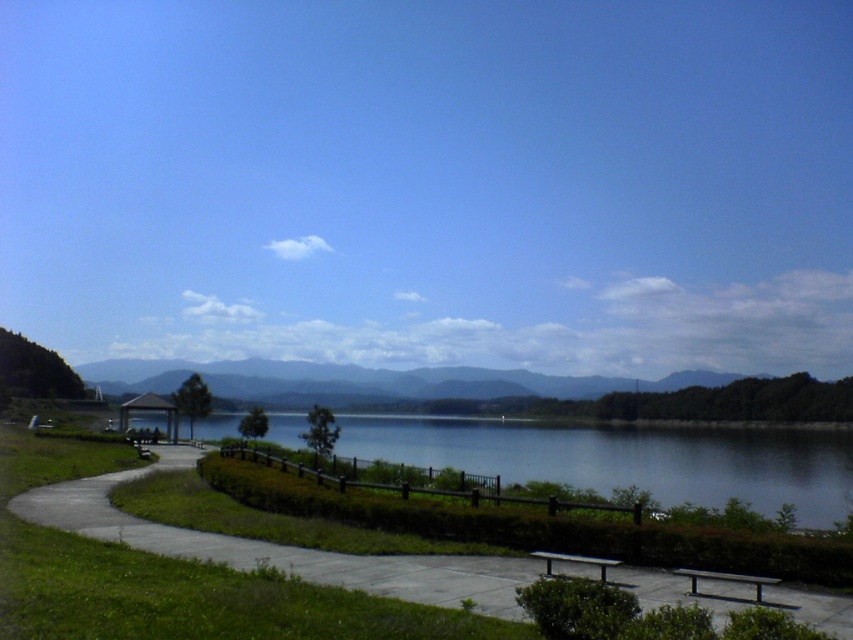
Does concrete at center have a greater height compared to wooden park bench at lower center?

Indeed, concrete at center has a greater height compared to wooden park bench at lower center.

Can you confirm if concrete at center is bigger than wooden park bench at lower center?

Yes, concrete at center is bigger than wooden park bench at lower center.

Locate an element on the screen. concrete at center is located at coordinates (276, 547).

The image size is (853, 640). I want to click on concrete at center, so click(276, 547).

Does wooden bench at lower right have a lesser height compared to wooden park bench at lower center?

Correct, wooden bench at lower right is not as tall as wooden park bench at lower center.

Measure the distance from wooden bench at lower right to wooden park bench at lower center.

wooden bench at lower right and wooden park bench at lower center are 1.58 meters apart.

I want to click on wooden bench at lower right, so click(726, 579).

Which is behind, point (257, 561) or point (758, 593)?

Point (257, 561)

Which is more to the right, concrete at center or wooden bench at lower right?

wooden bench at lower right is more to the right.

What do you see at coordinates (276, 547) in the screenshot? Image resolution: width=853 pixels, height=640 pixels. I see `concrete at center` at bounding box center [276, 547].

Where is `concrete at center`? concrete at center is located at coordinates (276, 547).